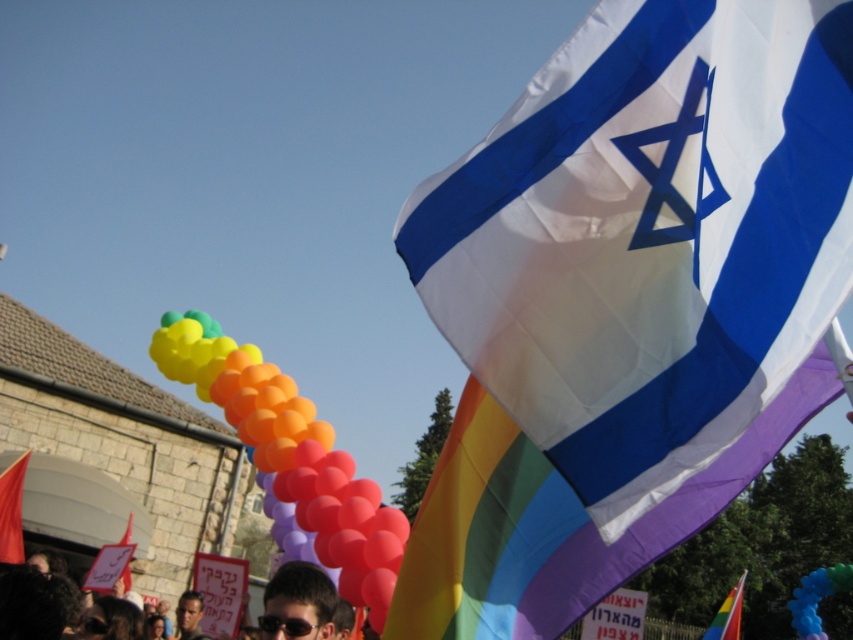
You are standing in the outdoor scene and want to reach both the Israeli flag and the rainbow banner. Which point, point 1 at coordinates (740, 211) or point 2 at coordinates (436, 544), is closer to you?

Point 1 at coordinates (740, 211) is closer to the viewer than point 2 at coordinates (436, 544).